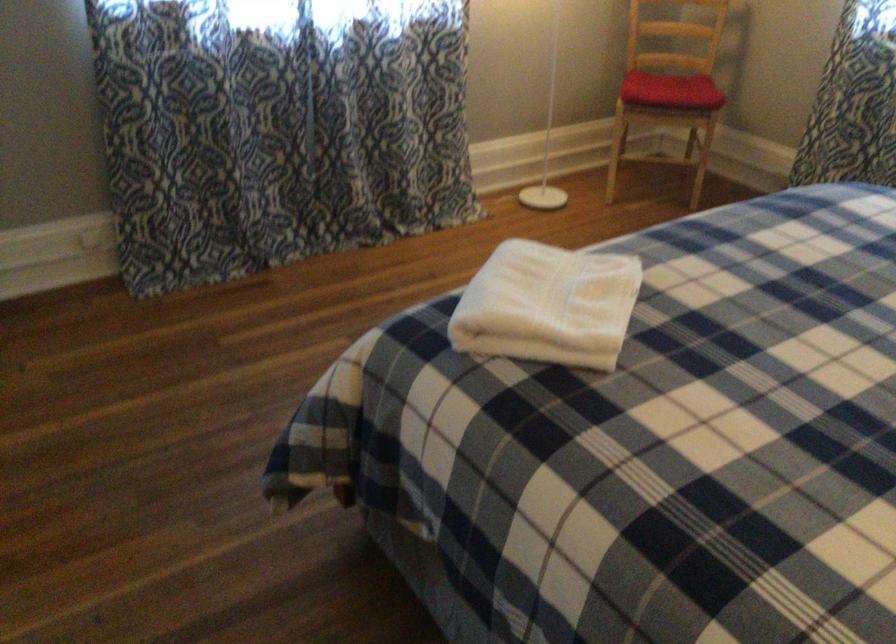
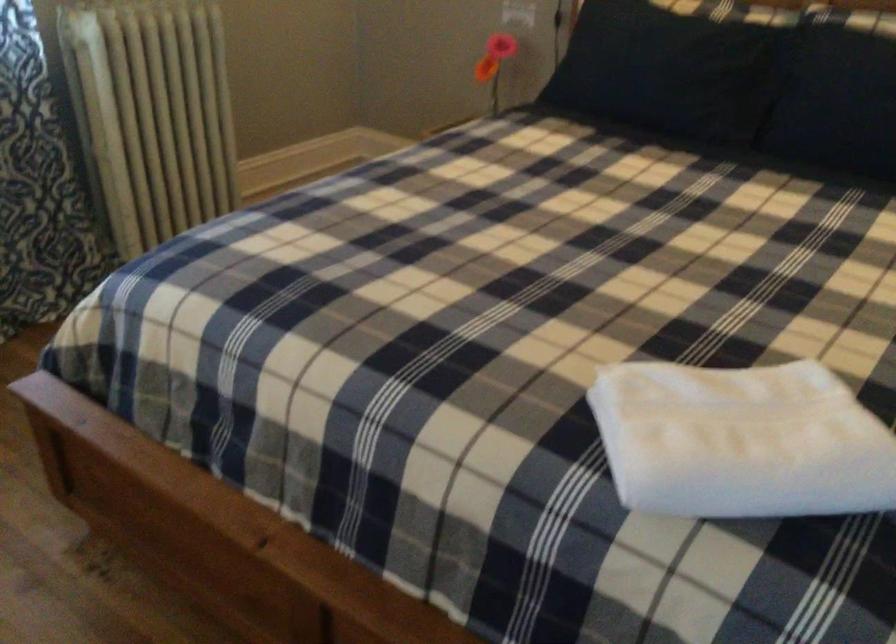
Locate, in the second image, the point that corresponds to pixel 524 301 in the first image.

(741, 440)